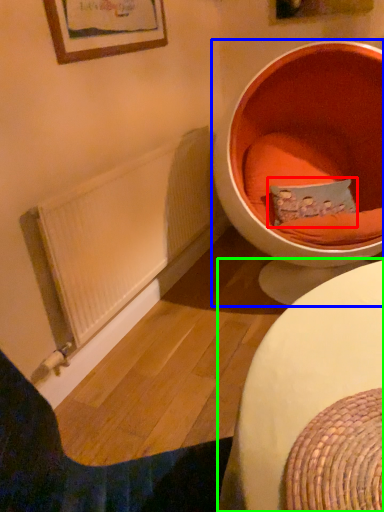
Question: Estimate the real-world distances between objects in this image. Which object is farther from pillow (highlighted by a red box), toilet (highlighted by a blue box) or table (highlighted by a green box)?

Choices:
 (A) toilet
 (B) table

Answer: (B)